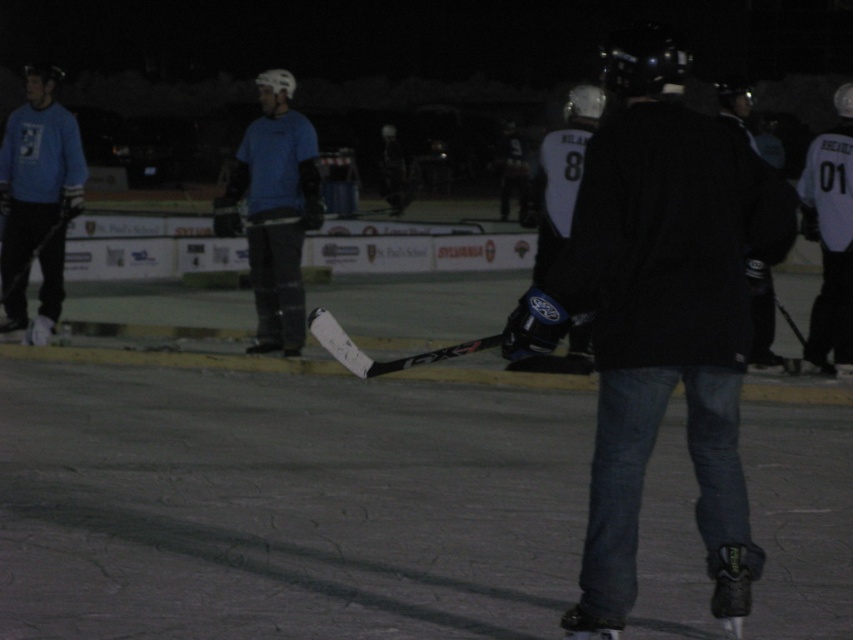
Is blue matte hockey stick at center above matte blue sweater at left?

No, blue matte hockey stick at center is not above matte blue sweater at left.

Who is more distant from viewer, (300, 188) or (57, 202)?

The point (57, 202) is behind.

Where is `blue matte hockey stick at center`? This screenshot has width=853, height=640. blue matte hockey stick at center is located at coordinates (276, 209).

This screenshot has height=640, width=853. I want to click on black matte jacket at center, so click(660, 316).

Does point (664, 307) lie behind point (846, 84)?

No, (664, 307) is closer to viewer.

At what (x,y) coordinates should I click in order to perform the action: click on black matte jacket at center. Please return your answer as a coordinate pair (x, y). The height and width of the screenshot is (640, 853). Looking at the image, I should click on (660, 316).

Between point (286, 163) and point (833, 198), which one is positioned in front?

Point (833, 198)

This screenshot has height=640, width=853. Describe the element at coordinates (276, 209) in the screenshot. I see `blue matte hockey stick at center` at that location.

Where is `blue matte hockey stick at center`? The width and height of the screenshot is (853, 640). blue matte hockey stick at center is located at coordinates (276, 209).